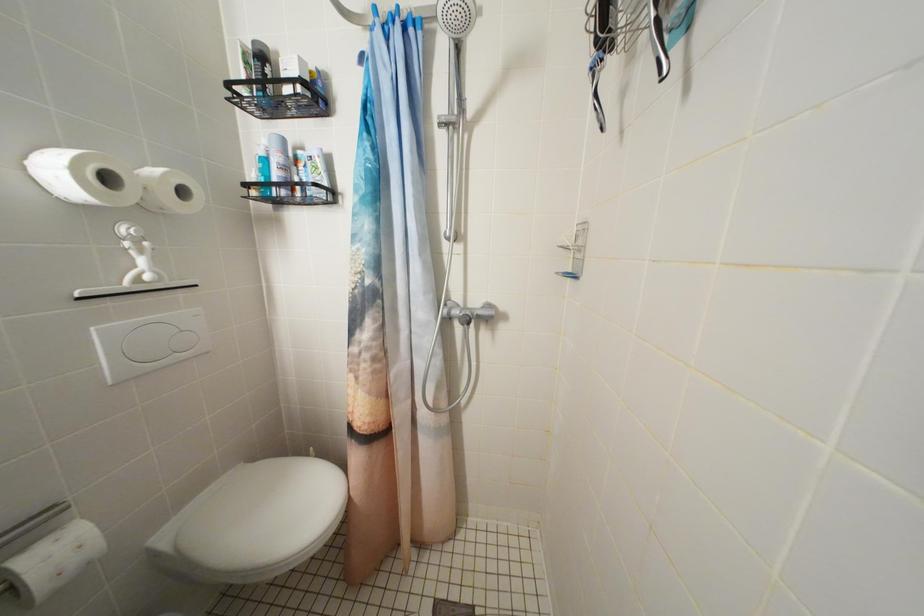
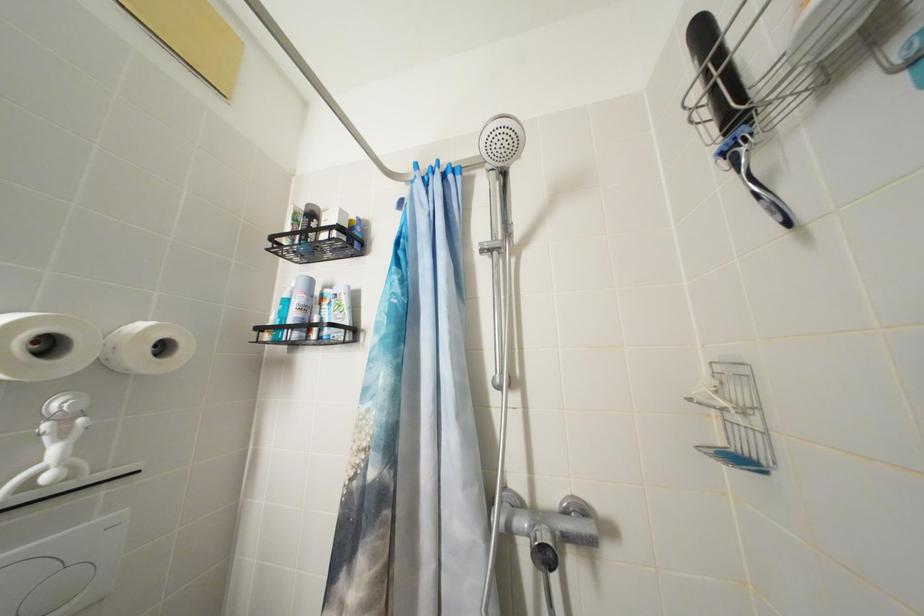
Question: Which direction would the cameraman need to move to produce the second image? Reply with the corresponding letter.

Choices:
 (A) Left
 (B) Right
 (C) Forward
 (D) Backward

Answer: (C)